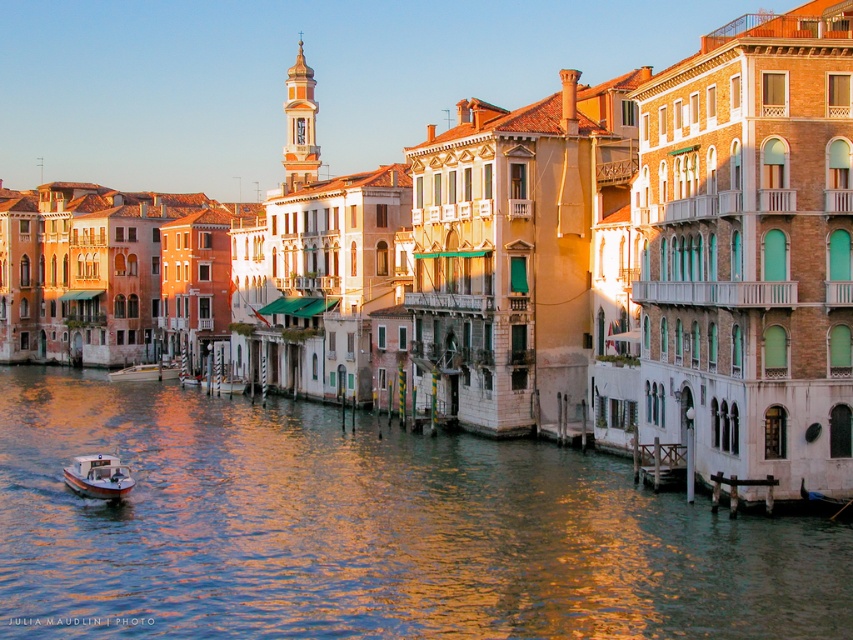
Question: Which point is closer to the camera?

Choices:
 (A) (753, 557)
 (B) (165, 369)

Answer: (A)

Question: Does white plastic boat at lower left have a lesser width compared to wooden boat at center?

Choices:
 (A) yes
 (B) no

Answer: (A)

Question: Among these objects, which one is farthest from the camera?

Choices:
 (A) white plastic boat at lower left
 (B) shiny golden water at center
 (C) wooden boat at center

Answer: (C)

Question: Does shiny golden water at center appear over white plastic boat at lower left?

Choices:
 (A) no
 (B) yes

Answer: (A)

Question: Is shiny golden water at center to the left of white plastic boat at lower left from the viewer's perspective?

Choices:
 (A) no
 (B) yes

Answer: (A)

Question: Which of these objects is positioned closest to the white plastic boat at lower left?

Choices:
 (A) shiny golden water at center
 (B) wooden boat at center

Answer: (A)